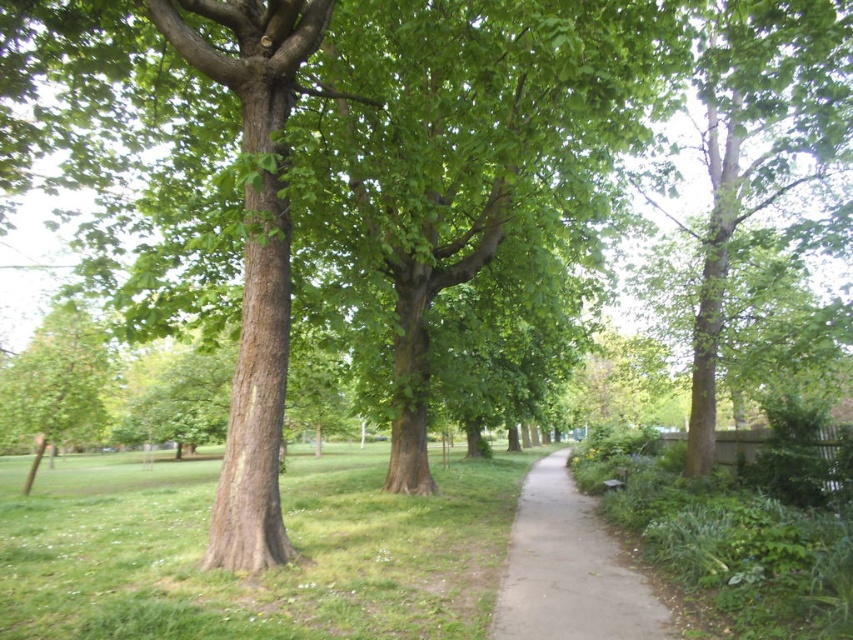
You are a gardener who wants to plant a new shrub in the park. You have a small shrub that requires partial shade. Given the current layout, which location would be better for planting the shrub between the green grass at center and the green leafy tree at right?

The green grass at center is positioned under the green leafy tree at right, so planting the shrub there would provide the required partial shade from the tree.

You are a gardener who needs to mow the lawn. You see the green grass at center and the green leafy tree at right in the park. Which area should you avoid mowing to prevent damaging the tree?

You should avoid mowing the area near the green leafy tree at right because the green grass at center is positioned on the left side of it, meaning the tree is on the right side of the grass. Mowing too close to the tree trunk could damage its roots.

You are standing at the entrance of the park and want to reach the gray concrete path at center. According to the coordinates provided, in which direction should you walk from your current position to reach it?

The gray concrete path at center is located at coordinates point [569,570]. Since coordinates typically increase from the bottom left corner, this position is towards the upper right of the image. Therefore, you should walk towards the upper right direction to reach the gray concrete path at center.